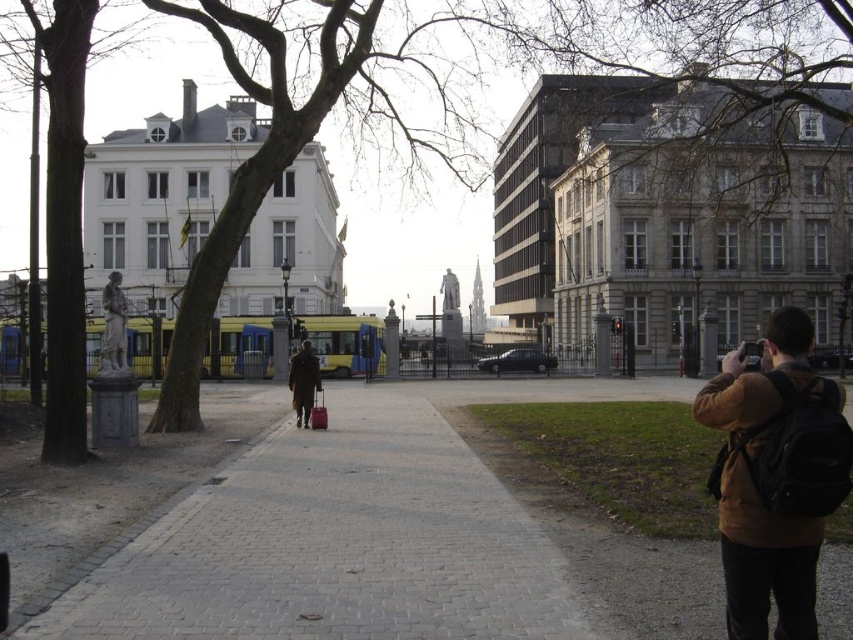
Is the position of gray brick pavement at center less distant than that of brown leather coat at center?

Yes, it is.

Between gray brick pavement at center and brown leather coat at center, which one has more height?

brown leather coat at center is taller.

Image resolution: width=853 pixels, height=640 pixels. In order to click on gray brick pavement at center in this screenshot , I will do `click(393, 541)`.

Where is `gray brick pavement at center`? The image size is (853, 640). gray brick pavement at center is located at coordinates (393, 541).

Find the location of a particular element. The height and width of the screenshot is (640, 853). brown leather jacket at lower right is located at coordinates (775, 486).

Does brown leather jacket at lower right appear on the left side of brown leather coat at center?

No, brown leather jacket at lower right is not to the left of brown leather coat at center.

The height and width of the screenshot is (640, 853). Describe the element at coordinates (775, 486) in the screenshot. I see `brown leather jacket at lower right` at that location.

This screenshot has width=853, height=640. What are the coordinates of `brown leather jacket at lower right` in the screenshot? It's located at (775, 486).

Does gray brick pavement at center appear on the left side of brown leather jacket at lower right?

Correct, you'll find gray brick pavement at center to the left of brown leather jacket at lower right.

In the scene shown: Is gray brick pavement at center smaller than brown leather jacket at lower right?

No.

Locate an element on the screen. This screenshot has width=853, height=640. gray brick pavement at center is located at coordinates (393, 541).

The height and width of the screenshot is (640, 853). I want to click on gray brick pavement at center, so click(x=393, y=541).